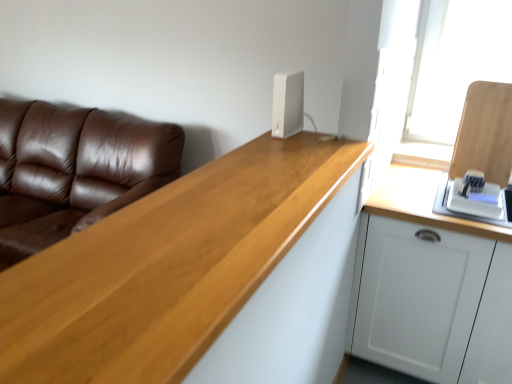
Question: From the image's perspective, does white matte cabinet at right appear lower than brown leather couch at left?

Choices:
 (A) no
 (B) yes

Answer: (B)

Question: Can you see white matte cabinet at right touching brown leather couch at left?

Choices:
 (A) no
 (B) yes

Answer: (A)

Question: Is white matte cabinet at right further to camera compared to brown leather couch at left?

Choices:
 (A) no
 (B) yes

Answer: (A)

Question: Is white matte cabinet at right thinner than brown leather couch at left?

Choices:
 (A) yes
 (B) no

Answer: (A)

Question: Can you confirm if white matte cabinet at right is positioned to the left of brown leather couch at left?

Choices:
 (A) yes
 (B) no

Answer: (B)

Question: Is white matte cabinet at right bigger than brown leather couch at left?

Choices:
 (A) yes
 (B) no

Answer: (B)

Question: Would you say brown leather couch at left is part of light wood countertop at center's contents?

Choices:
 (A) yes
 (B) no

Answer: (B)

Question: Is light wood countertop at center positioned behind brown leather couch at left?

Choices:
 (A) yes
 (B) no

Answer: (B)

Question: Is light wood countertop at center closer to the viewer compared to brown leather couch at left?

Choices:
 (A) yes
 (B) no

Answer: (A)

Question: From a real-world perspective, does light wood countertop at center stand above brown leather couch at left?

Choices:
 (A) no
 (B) yes

Answer: (B)

Question: Is light wood countertop at center oriented towards brown leather couch at left?

Choices:
 (A) yes
 (B) no

Answer: (B)

Question: Considering the relative sizes of light wood countertop at center and brown leather couch at left in the image provided, is light wood countertop at center smaller than brown leather couch at left?

Choices:
 (A) yes
 (B) no

Answer: (A)

Question: Is light wood countertop at center oriented away from white plastic router at upper center?

Choices:
 (A) no
 (B) yes

Answer: (A)